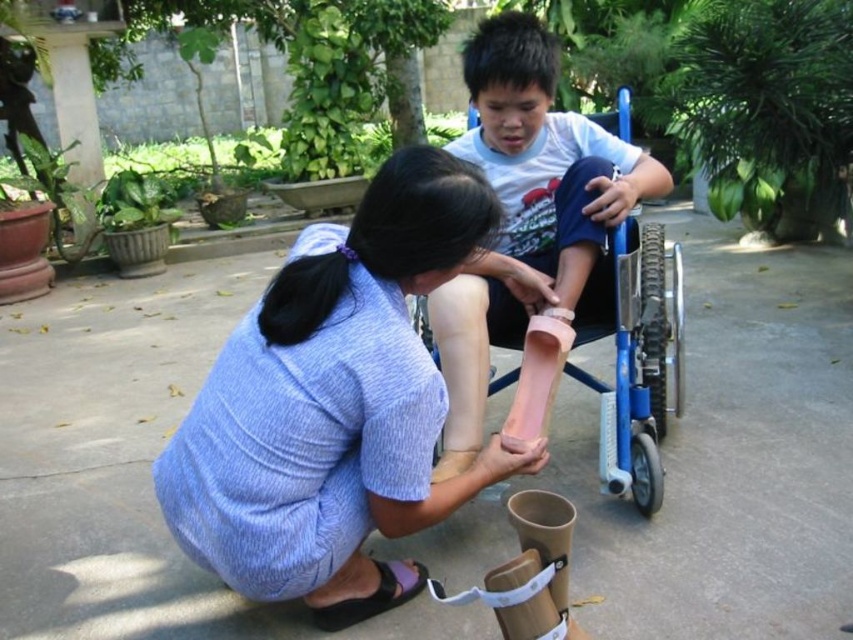
Question: Does matte blue dress at center appear under black fabric sandal at lower center?

Choices:
 (A) no
 (B) yes

Answer: (A)

Question: Which object is farther from the camera taking this photo?

Choices:
 (A) black fabric sandal at lower center
 (B) pink matte prosthetic leg at center

Answer: (A)

Question: Estimate the real-world distances between objects in this image. Which object is closer to the matte blue dress at center?

Choices:
 (A) pink matte prosthetic leg at center
 (B) black fabric sandal at lower center

Answer: (B)

Question: Does pink matte prosthetic leg at center appear on the left side of black fabric sandal at lower center?

Choices:
 (A) no
 (B) yes

Answer: (A)

Question: Which point is closer to the camera taking this photo?

Choices:
 (A) (500, 72)
 (B) (426, 176)

Answer: (B)

Question: Can you confirm if matte blue dress at center is bigger than black fabric sandal at lower center?

Choices:
 (A) yes
 (B) no

Answer: (A)